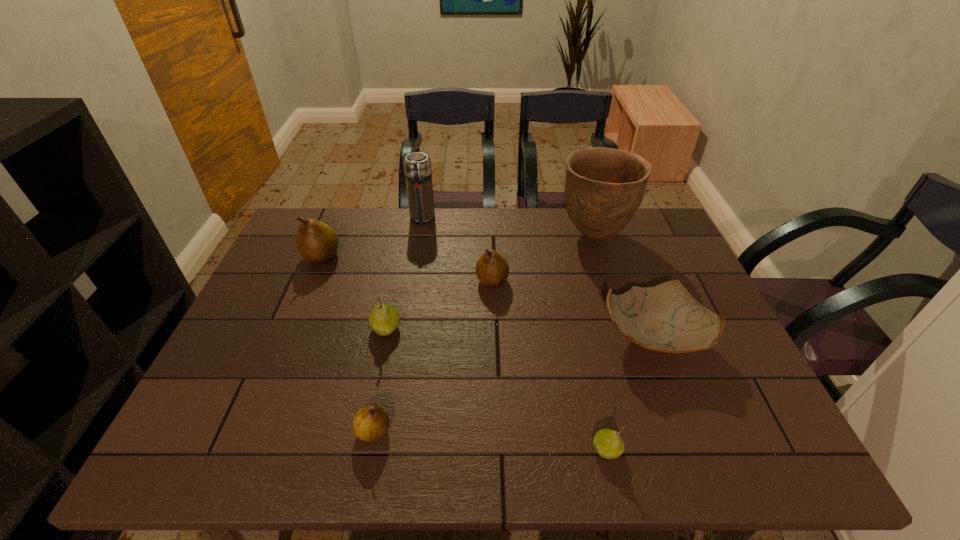
I want to click on blank space at the right edge of the desktop, so click(730, 384).

Where is `vacant area that lies between the smaller green pear and the nearer pottery`? vacant area that lies between the smaller green pear and the nearer pottery is located at coordinates (630, 393).

I want to click on free space between the farther pottery and the smallest brown pear, so click(484, 333).

Locate an element on the screen. blank region between the farther green pear and the third tallest object is located at coordinates (354, 293).

Locate an element on the screen. Image resolution: width=960 pixels, height=540 pixels. free spot between the shorter pottery and the taller pottery is located at coordinates (624, 286).

This screenshot has width=960, height=540. In order to click on vacant area that lies between the farther pottery and the shorter pottery in this screenshot , I will do `click(624, 286)`.

You are a GUI agent. You are given a task and a screenshot of the screen. Output one action in this format:
    pyautogui.click(x=<x>, y=<y>)
    Task: Click on the empty space between the fourth object from right to left and the smaller green pear
    This screenshot has height=540, width=960.
    Given the screenshot: What is the action you would take?
    pyautogui.click(x=549, y=365)

This screenshot has height=540, width=960. I want to click on vacant space that is in between the fourth object from right to left and the seventh shortest object, so click(457, 250).

Where is `free spot between the second tallest object and the nearer pottery`? free spot between the second tallest object and the nearer pottery is located at coordinates (538, 278).

This screenshot has height=540, width=960. In order to click on vacant region between the shorter pottery and the rightmost pear in this screenshot , I will do `click(630, 393)`.